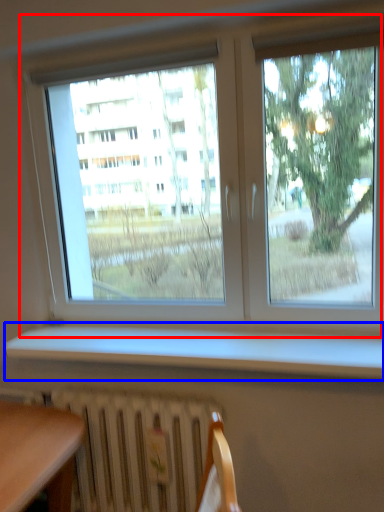
Question: Which of the following is the farthest to the observer, window (highlighted by a red box) or window sill (highlighted by a blue box)?

Choices:
 (A) window
 (B) window sill

Answer: (A)